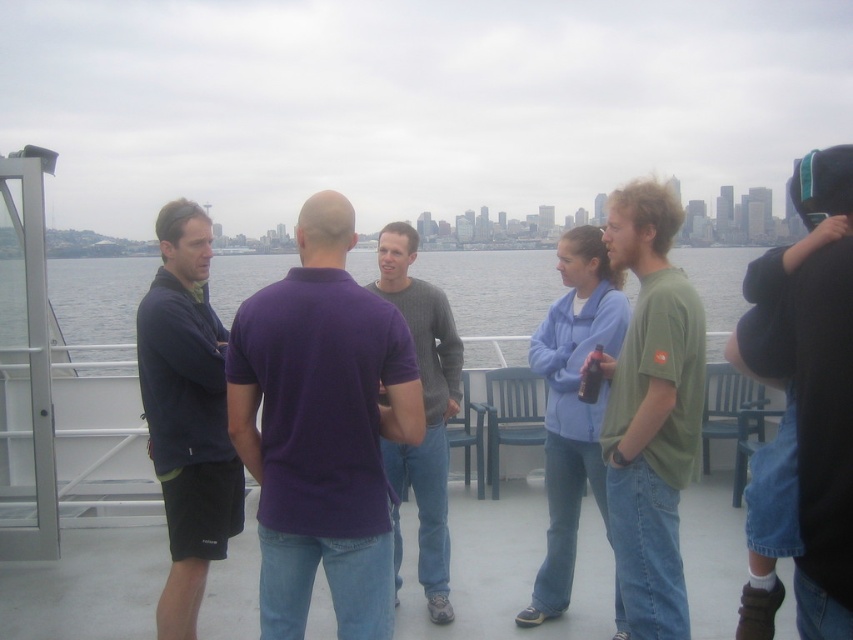
Is green matte shirt at center to the right of clear water at center from the viewer's perspective?

Yes, green matte shirt at center is to the right of clear water at center.

Find the location of a particular element. green matte shirt at center is located at coordinates (651, 412).

Does purple cotton polo shirt at center appear on the right side of green cotton hoodie at upper right?

Incorrect, purple cotton polo shirt at center is not on the right side of green cotton hoodie at upper right.

Which is behind, point (415, 372) or point (807, 461)?

The point (415, 372) is more distant.

I want to click on purple cotton polo shirt at center, so click(x=322, y=428).

Is green cotton hoodie at upper right bigger than dark blue short sleeve shirt at left?

Yes.

Is green cotton hoodie at upper right to the right of dark blue short sleeve shirt at left from the viewer's perspective?

Yes, green cotton hoodie at upper right is to the right of dark blue short sleeve shirt at left.

Who is more forward, [834,160] or [177,388]?

Point [834,160] is more forward.

This screenshot has width=853, height=640. I want to click on green cotton hoodie at upper right, so click(807, 392).